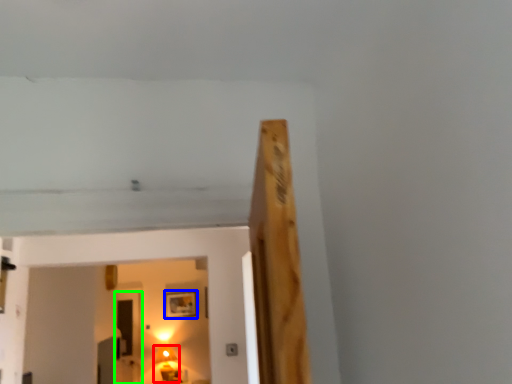
Question: Which object is the farthest from lamp (highlighted by a red box)? Choose among these: picture frame (highlighted by a blue box) or glass door (highlighted by a green box).

Choices:
 (A) picture frame
 (B) glass door

Answer: (A)